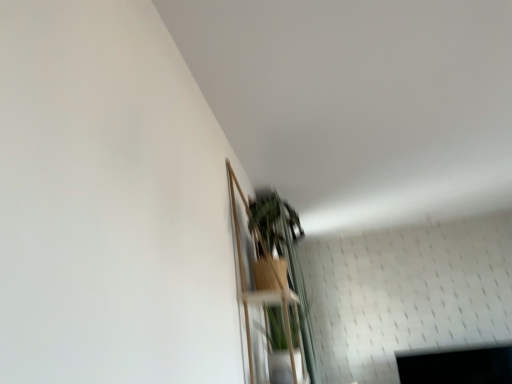
Question: In which direction should I rotate to look at wooden shelf at upper center, the second shelf in the bottom-to-top sequence?

Choices:
 (A) left
 (B) right

Answer: (B)

Question: Is wooden shelf at lower center, which ranks as the second shelf in top-to-bottom order, wider than wooden shelf at upper center, the 1th shelf positioned from the top?

Choices:
 (A) no
 (B) yes

Answer: (B)

Question: Does wooden shelf at lower center, which ranks as the second shelf in top-to-bottom order, lie in front of wooden shelf at upper center, the 1th shelf positioned from the top?

Choices:
 (A) yes
 (B) no

Answer: (B)

Question: Considering the relative positions of wooden shelf at lower center, which ranks as the second shelf in top-to-bottom order, and wooden shelf at upper center, the second shelf in the bottom-to-top sequence, in the image provided, is wooden shelf at lower center, which ranks as the second shelf in top-to-bottom order, to the right of wooden shelf at upper center, the second shelf in the bottom-to-top sequence, from the viewer's perspective?

Choices:
 (A) no
 (B) yes

Answer: (B)

Question: Is wooden shelf at lower center, which ranks as the second shelf in top-to-bottom order, not close to wooden shelf at upper center, the 1th shelf positioned from the top?

Choices:
 (A) no
 (B) yes

Answer: (A)

Question: Considering the relative sizes of wooden shelf at lower center, which ranks as the second shelf in top-to-bottom order, and wooden shelf at upper center, the 1th shelf positioned from the top, in the image provided, is wooden shelf at lower center, which ranks as the second shelf in top-to-bottom order, smaller than wooden shelf at upper center, the 1th shelf positioned from the top,?

Choices:
 (A) yes
 (B) no

Answer: (A)

Question: Is wooden shelf at upper center, the 1th shelf positioned from the top, at the back of wooden shelf at lower center, the first shelf ordered from the bottom?

Choices:
 (A) no
 (B) yes

Answer: (B)

Question: Is wooden shelf at upper center, the 1th shelf positioned from the top, in front of wooden shelf at lower center, the first shelf ordered from the bottom?

Choices:
 (A) no
 (B) yes

Answer: (B)

Question: Considering the relative sizes of wooden shelf at upper center, the second shelf in the bottom-to-top sequence, and wooden shelf at lower center, which ranks as the second shelf in top-to-bottom order, in the image provided, is wooden shelf at upper center, the second shelf in the bottom-to-top sequence, thinner than wooden shelf at lower center, which ranks as the second shelf in top-to-bottom order,?

Choices:
 (A) no
 (B) yes

Answer: (B)

Question: Does wooden shelf at upper center, the second shelf in the bottom-to-top sequence, have a smaller size compared to wooden shelf at lower center, which ranks as the second shelf in top-to-bottom order?

Choices:
 (A) yes
 (B) no

Answer: (B)

Question: Does wooden shelf at upper center, the second shelf in the bottom-to-top sequence, have a lesser height compared to wooden shelf at lower center, the first shelf ordered from the bottom?

Choices:
 (A) yes
 (B) no

Answer: (B)

Question: Is wooden shelf at upper center, the 1th shelf positioned from the top, outside wooden shelf at lower center, which ranks as the second shelf in top-to-bottom order?

Choices:
 (A) yes
 (B) no

Answer: (A)

Question: From a real-world perspective, is wooden shelf at upper center, the 1th shelf positioned from the top, under wooden shelf at lower center, the first shelf ordered from the bottom?

Choices:
 (A) yes
 (B) no

Answer: (B)

Question: From a real-world perspective, is wooden shelf at lower center, which ranks as the second shelf in top-to-bottom order, above or below wooden shelf at upper center, the second shelf in the bottom-to-top sequence?

Choices:
 (A) below
 (B) above

Answer: (A)